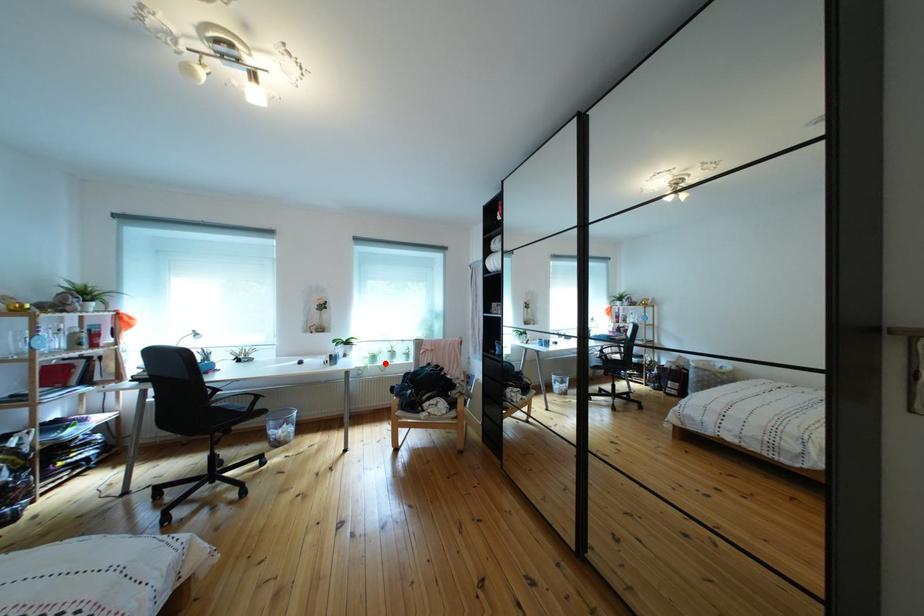
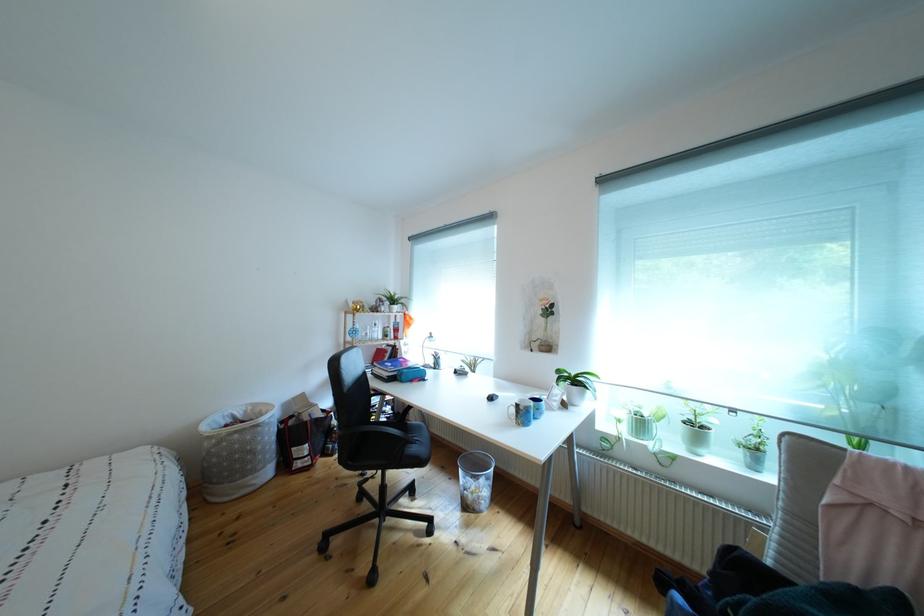
Find the pixel in the second image that matches the highlighted location in the first image.

(652, 430)